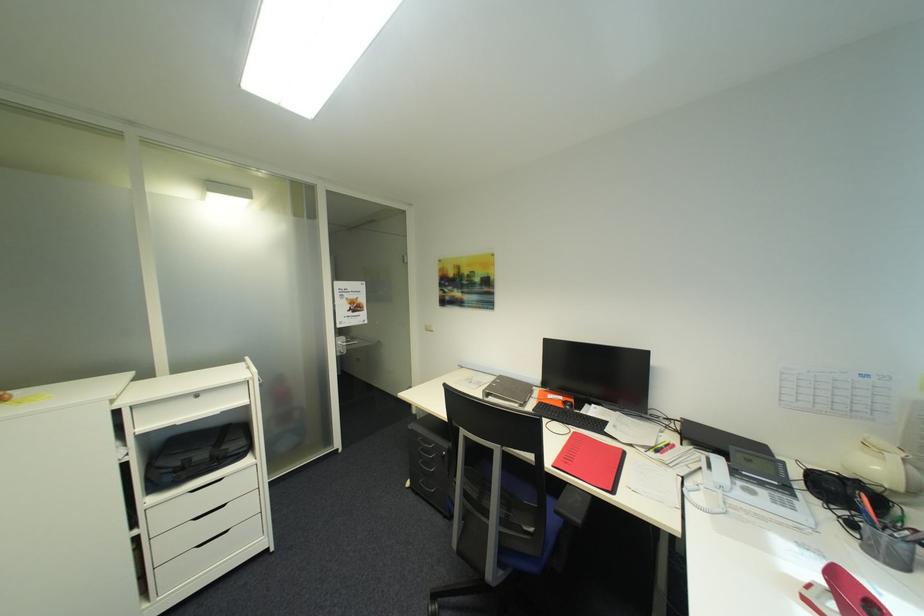
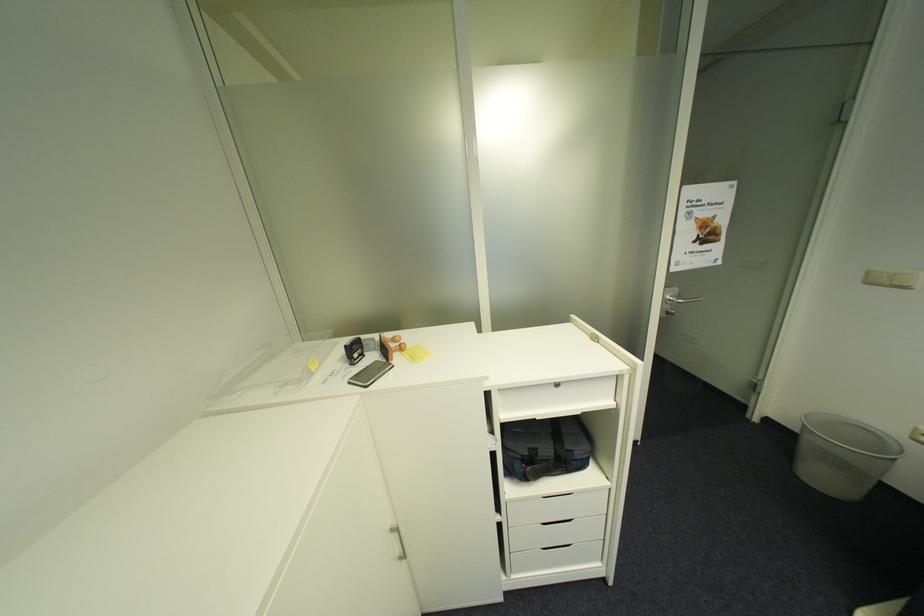
Find the pixel in the second image that matches point (348, 345) in the first image.

(676, 301)